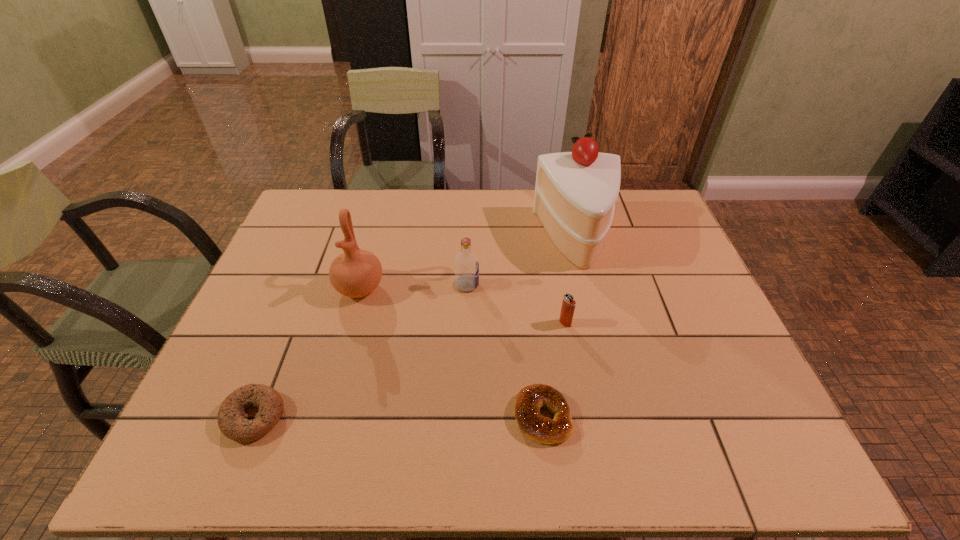
Identify the location of free space at the left edge of the desktop. (284, 234).

Where is `vacant space at the right edge of the desktop`? This screenshot has height=540, width=960. vacant space at the right edge of the desktop is located at coordinates (635, 242).

The image size is (960, 540). In order to click on free spot at the near left corner of the desktop in this screenshot , I will do `click(213, 432)`.

The image size is (960, 540). In order to click on free spot at the far right corner of the desktop in this screenshot , I will do `click(660, 215)`.

Image resolution: width=960 pixels, height=540 pixels. Identify the location of free location at the near right corner. (745, 460).

At what (x,y) coordinates should I click in order to perform the action: click on vacant space that is in between the leftmost object and the third shortest object. Please return your answer as a coordinate pair (x, y). This screenshot has height=540, width=960. Looking at the image, I should click on (410, 369).

Identify the location of free area in between the left bagel and the right bagel. This screenshot has width=960, height=540. (398, 416).

Where is `vacant space that's between the second object from left to right and the third shortest object`? vacant space that's between the second object from left to right and the third shortest object is located at coordinates (463, 306).

The image size is (960, 540). In order to click on free point between the leftmost object and the pottery in this screenshot , I will do `click(307, 352)`.

Image resolution: width=960 pixels, height=540 pixels. In order to click on vacant area that lies between the leftmost object and the igniter in this screenshot , I will do `click(410, 369)`.